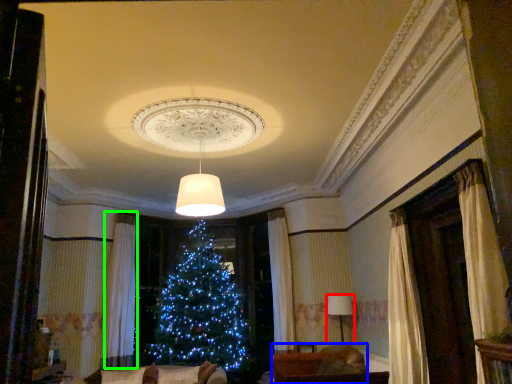
Question: Estimate the real-world distances between objects in this image. Which object is closer to lamp (highlighted by a red box), furniture (highlighted by a blue box) or curtain (highlighted by a green box)?

Choices:
 (A) furniture
 (B) curtain

Answer: (A)